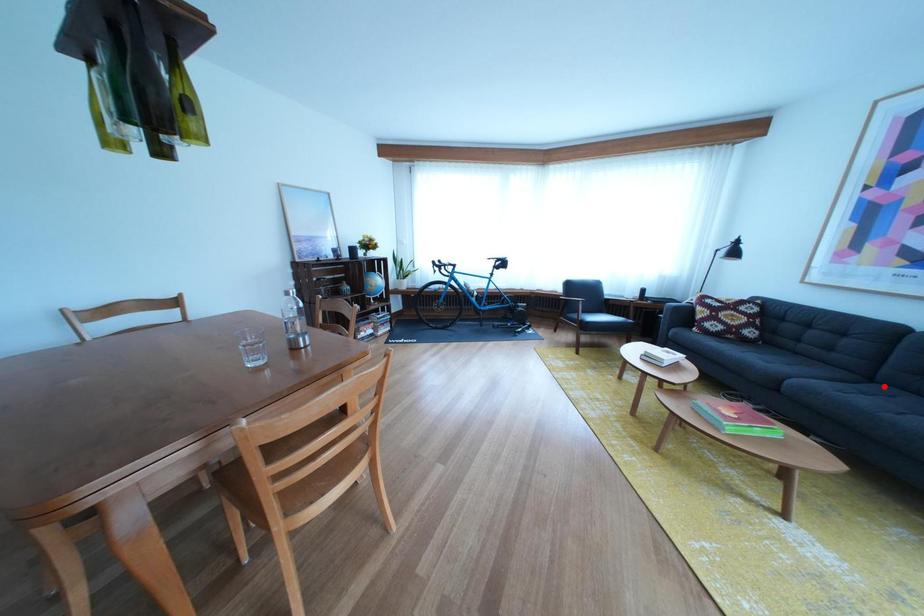
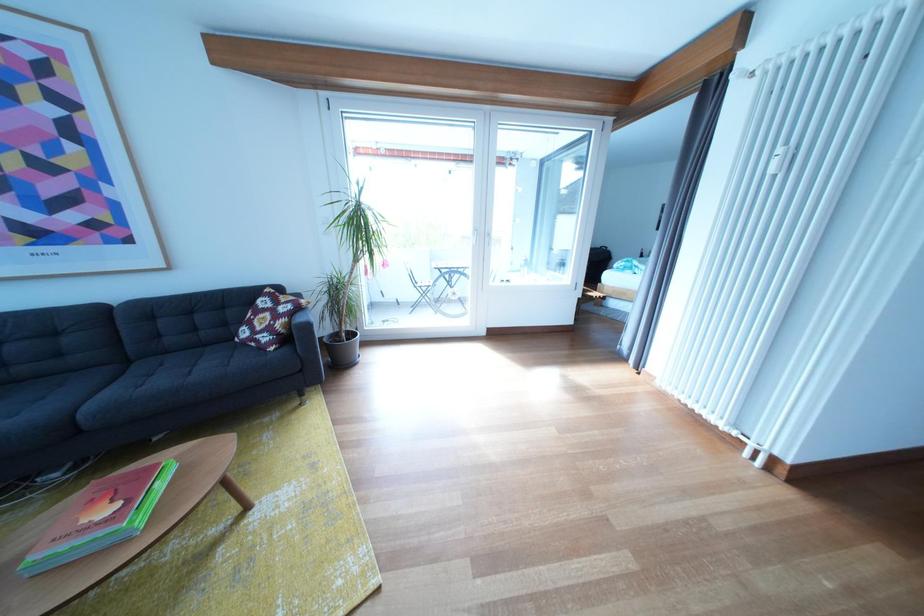
Question: I am providing you with two images of the same scene from different viewpoints. Image1 has a red point marked. In image2, the corresponding 3D location appears at what relative position? Reply with the corresponding letter.

Choices:
 (A) Closer
 (B) Farther

Answer: (A)